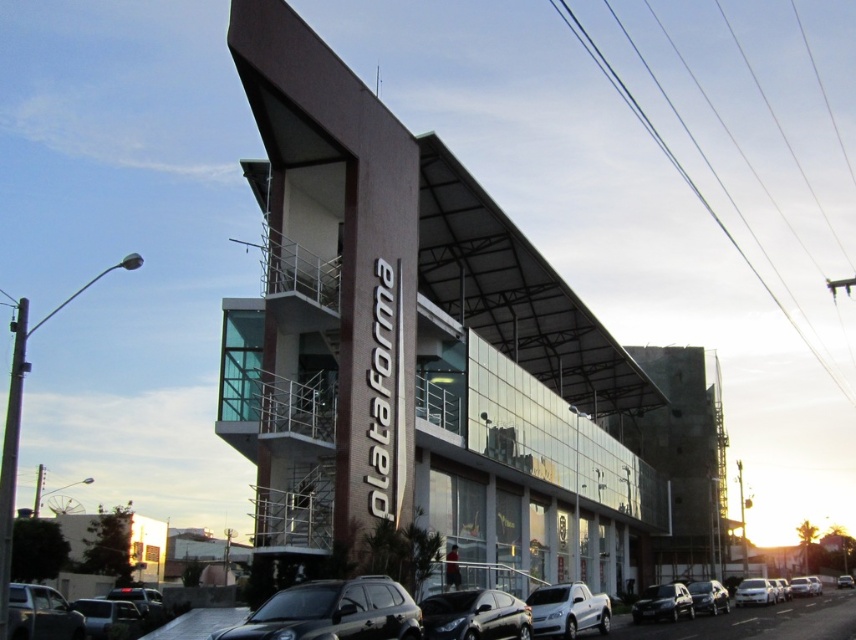
Is the position of satin black suv at lower center less distant than that of satin black car at lower center?

Yes, it is in front of satin black car at lower center.

Measure the distance between satin black suv at lower center and camera.

A distance of 33.30 meters exists between satin black suv at lower center and camera.

Identify the location of satin black suv at lower center. Image resolution: width=856 pixels, height=640 pixels. (331, 612).

Between silver metallic car at lower left and satin black car at lower right, which one appears on the right side from the viewer's perspective?

satin black car at lower right

Can you confirm if silver metallic car at lower left is bigger than satin black car at lower right?

Yes.

At what (x,y) coordinates should I click in order to perform the action: click on silver metallic car at lower left. Please return your answer as a coordinate pair (x, y). Image resolution: width=856 pixels, height=640 pixels. Looking at the image, I should click on tap(107, 616).

Is matte black car at lower left above satin black car at lower right?

Indeed, matte black car at lower left is positioned over satin black car at lower right.

Who is positioned more to the right, matte black car at lower left or satin black car at lower right?

From the viewer's perspective, satin black car at lower right appears more on the right side.

The image size is (856, 640). What do you see at coordinates (40, 614) in the screenshot? I see `matte black car at lower left` at bounding box center [40, 614].

The height and width of the screenshot is (640, 856). Find the location of `matte black car at lower left`. matte black car at lower left is located at coordinates (40, 614).